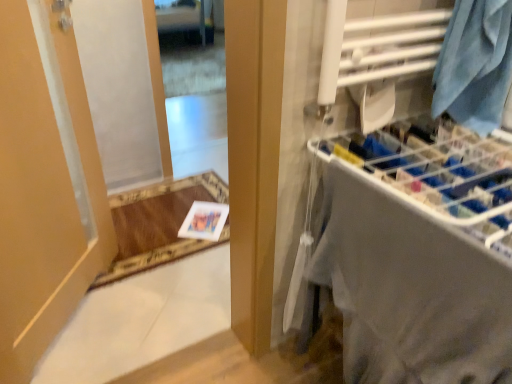
Question: From a real-world perspective, is blue fabric at upper right positioned under clear glass mirror at upper center based on gravity?

Choices:
 (A) yes
 (B) no

Answer: (B)

Question: Considering the relative positions of blue fabric at upper right and clear glass mirror at upper center in the image provided, is blue fabric at upper right behind clear glass mirror at upper center?

Choices:
 (A) no
 (B) yes

Answer: (A)

Question: Is blue fabric at upper right facing away from clear glass mirror at upper center?

Choices:
 (A) yes
 (B) no

Answer: (B)

Question: Can you confirm if blue fabric at upper right is positioned to the left of clear glass mirror at upper center?

Choices:
 (A) yes
 (B) no

Answer: (B)

Question: Is blue fabric at upper right bigger than clear glass mirror at upper center?

Choices:
 (A) yes
 (B) no

Answer: (B)

Question: Considering the positions of point (3, 100) and point (402, 375), is point (3, 100) closer or farther from the camera than point (402, 375)?

Choices:
 (A) farther
 (B) closer

Answer: (A)

Question: Looking at the image, does matte beige door at left seem bigger or smaller compared to white fabric at right?

Choices:
 (A) big
 (B) small

Answer: (B)

Question: Would you say matte beige door at left is inside or outside white fabric at right?

Choices:
 (A) outside
 (B) inside

Answer: (A)

Question: Is matte beige door at left taller or shorter than white fabric at right?

Choices:
 (A) tall
 (B) short

Answer: (A)

Question: Considering their positions, is white paper at lower center located in front of or behind blue fabric at upper right?

Choices:
 (A) front
 (B) behind

Answer: (B)

Question: Looking at their shapes, would you say white paper at lower center is wider or thinner than blue fabric at upper right?

Choices:
 (A) wide
 (B) thin

Answer: (A)

Question: From a real-world perspective, is white paper at lower center above or below blue fabric at upper right?

Choices:
 (A) above
 (B) below

Answer: (B)

Question: Is white paper at lower center to the left or to the right of blue fabric at upper right in the image?

Choices:
 (A) left
 (B) right

Answer: (A)

Question: From a real-world perspective, relative to white fabric at right, is blue fabric at upper right vertically above or below?

Choices:
 (A) above
 (B) below

Answer: (A)

Question: Based on their positions, is blue fabric at upper right located to the left or right of white fabric at right?

Choices:
 (A) right
 (B) left

Answer: (A)